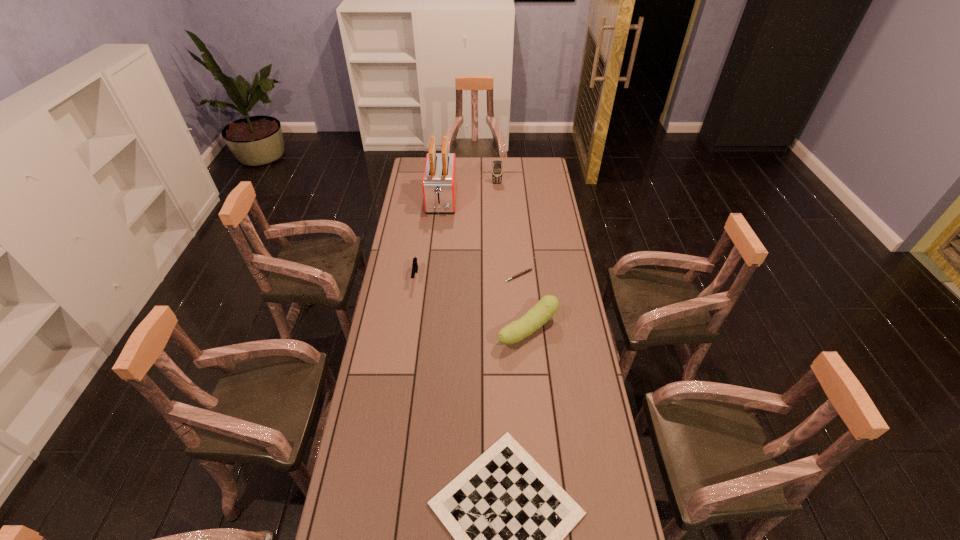
Where is `vacant region located at the nib of the pen`? The image size is (960, 540). vacant region located at the nib of the pen is located at coordinates [x=520, y=292].

Locate an element on the screen. toaster located in the left edge section of the desktop is located at coordinates (439, 182).

I want to click on pistol at the left edge, so click(414, 265).

The height and width of the screenshot is (540, 960). Identify the location of object that is at the right edge. (547, 306).

The height and width of the screenshot is (540, 960). I want to click on free spot at the far edge of the desktop, so click(x=517, y=179).

Where is `vacant space at the left edge of the desktop`? Image resolution: width=960 pixels, height=540 pixels. vacant space at the left edge of the desktop is located at coordinates (396, 276).

The width and height of the screenshot is (960, 540). In the image, there is a desktop. In order to click on vacant space at the right edge in this screenshot , I will do `click(552, 380)`.

Find the location of a particular element. The image size is (960, 540). unoccupied position between the fourth tallest object and the cucumber is located at coordinates (471, 303).

Find the location of `free spot between the fifth shortest object and the pen`. free spot between the fifth shortest object and the pen is located at coordinates (508, 230).

You are a GUI agent. You are given a task and a screenshot of the screen. Output one action in this format:
    pyautogui.click(x=<x>, y=<y>)
    Task: Click on the blank region between the tallest object and the fifth shortest object
    The height and width of the screenshot is (540, 960).
    Given the screenshot: What is the action you would take?
    pyautogui.click(x=469, y=191)